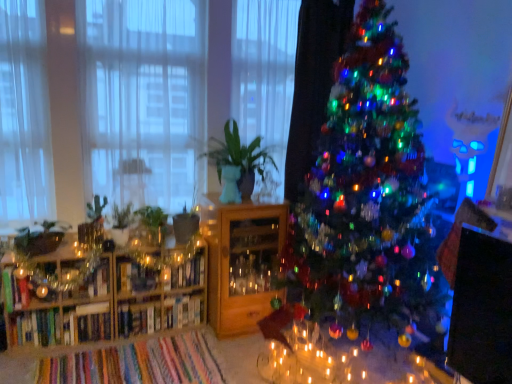
Identify the location of vacant space in front of hardcover book at center, positioned as the 1th book in left-to-right order. (123, 341).